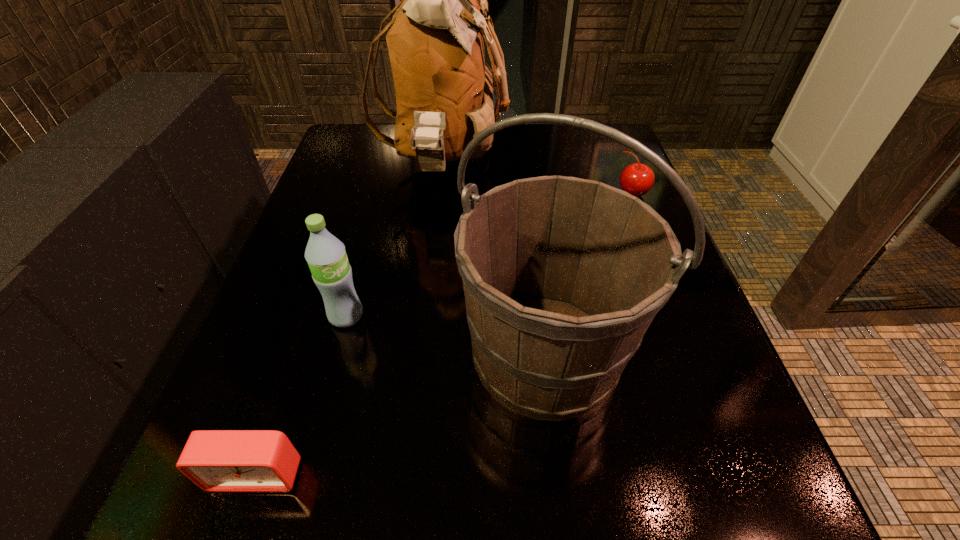
Identify which object is located as the second nearest to the alarm clock. Please provide its 2D coordinates. Your answer should be formatted as a tuple, i.e. [(x, y)], where the tuple contains the x and y coordinates of a point satisfying the conditions above.

[(326, 256)]

Identify which object is the third closest to the cherry. Please provide its 2D coordinates. Your answer should be formatted as a tuple, i.e. [(x, y)], where the tuple contains the x and y coordinates of a point satisfying the conditions above.

[(326, 256)]

This screenshot has height=540, width=960. In order to click on free space that satisfies the following two spatial constraints: 1. on the front-facing side of the backpack; 2. on the left side of the bucket in this screenshot , I will do `click(424, 353)`.

The image size is (960, 540). I want to click on vacant position in the image that satisfies the following two spatial constraints: 1. on the front-facing side of the backpack; 2. on the right side of the rightmost object, so click(441, 193).

Identify the location of vacant space that satisfies the following two spatial constraints: 1. on the front-facing side of the rightmost object; 2. on the left side of the backpack. This screenshot has height=540, width=960. (441, 193).

The image size is (960, 540). Identify the location of vacant point that satisfies the following two spatial constraints: 1. on the front-facing side of the rightmost object; 2. on the right side of the backpack. (441, 193).

You are a GUI agent. You are given a task and a screenshot of the screen. Output one action in this format:
    pyautogui.click(x=<x>, y=<y>)
    Task: Click on the vacant space that satisfies the following two spatial constraints: 1. on the front-facing side of the bucket; 2. on the left side of the backpack
    
    Given the screenshot: What is the action you would take?
    pyautogui.click(x=424, y=353)